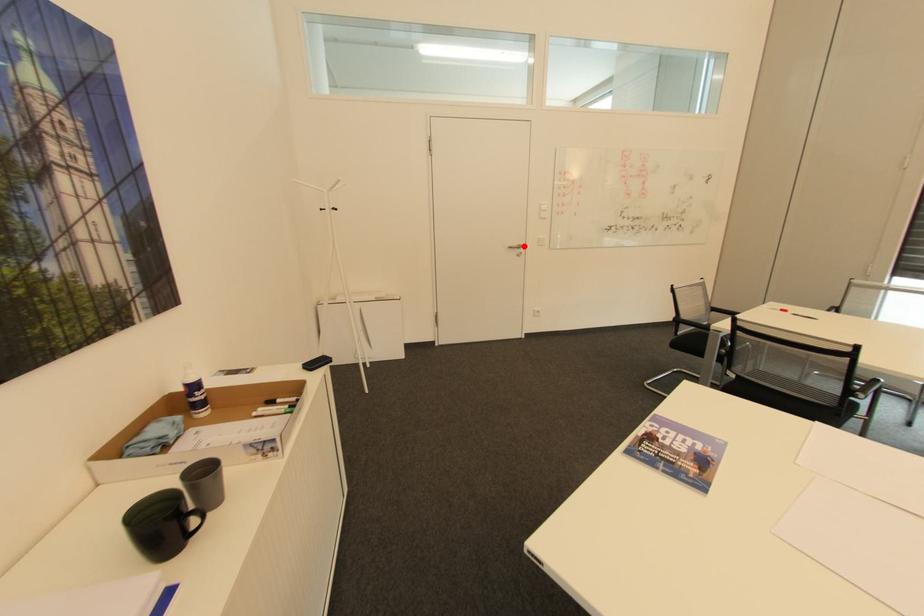
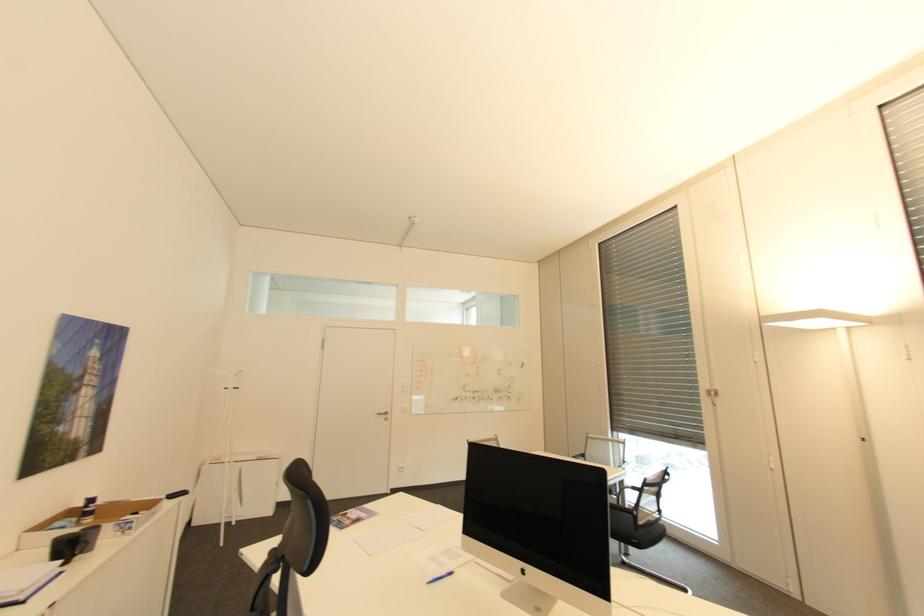
Question: I am providing you with two images of the same scene from different viewpoints. A red point is shown in image1. For the corresponding object point in image2, is it positioned nearer or farther from the camera?

Choices:
 (A) Nearer
 (B) Farther

Answer: (B)